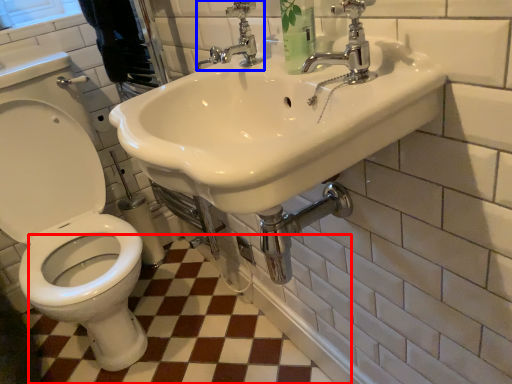
Question: Among these objects, which one is nearest to the camera, ceramic tile (highlighted by a red box) or tap (highlighted by a blue box)?

Choices:
 (A) ceramic tile
 (B) tap

Answer: (B)